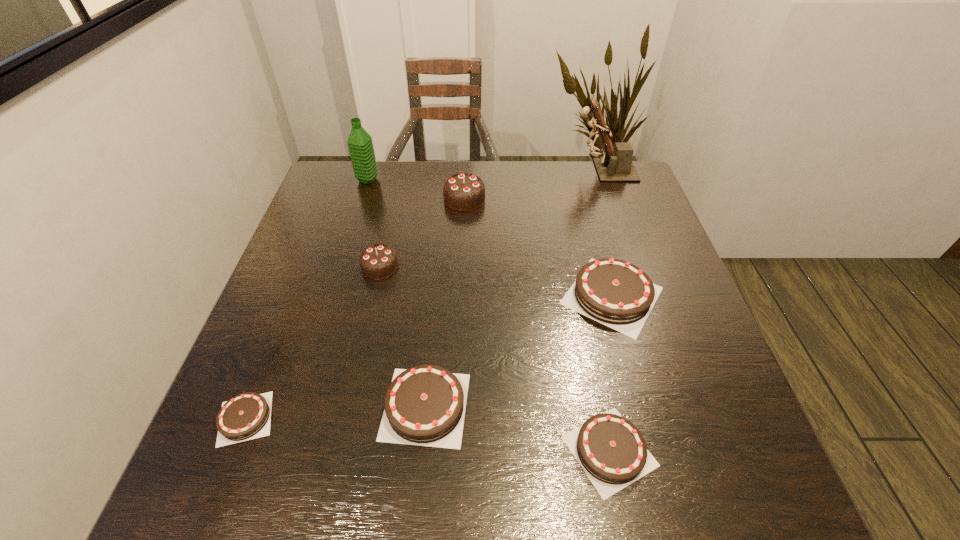
Identify the location of chocolate cake located at the left edge. (246, 416).

At what (x,y) coordinates should I click in order to perform the action: click on figurine that is at the right edge. Please return your answer as a coordinate pair (x, y). Looking at the image, I should click on (615, 164).

At what (x,y) coordinates should I click in order to perform the action: click on chocolate cake positioned at the right edge. Please return your answer as a coordinate pair (x, y). Looking at the image, I should click on (618, 294).

You are a GUI agent. You are given a task and a screenshot of the screen. Output one action in this format:
    pyautogui.click(x=<x>, y=<y>)
    Task: Click on the object positioned at the far left corner
    
    Given the screenshot: What is the action you would take?
    pyautogui.click(x=360, y=144)

Find the location of a particular element. object situated at the far right corner is located at coordinates (615, 164).

This screenshot has width=960, height=540. Identify the location of free space at the far edge. (509, 186).

Image resolution: width=960 pixels, height=540 pixels. In order to click on vacant space at the near edge in this screenshot , I will do `click(660, 452)`.

Find the location of a particular element. free point at the left edge is located at coordinates [323, 238].

Where is `vacant space at the right edge`? The width and height of the screenshot is (960, 540). vacant space at the right edge is located at coordinates (634, 350).

Find the location of a particular element. This screenshot has width=960, height=540. vacant point located between the biggest brown chocolate cake and the third biggest brown chocolate cake is located at coordinates (611, 373).